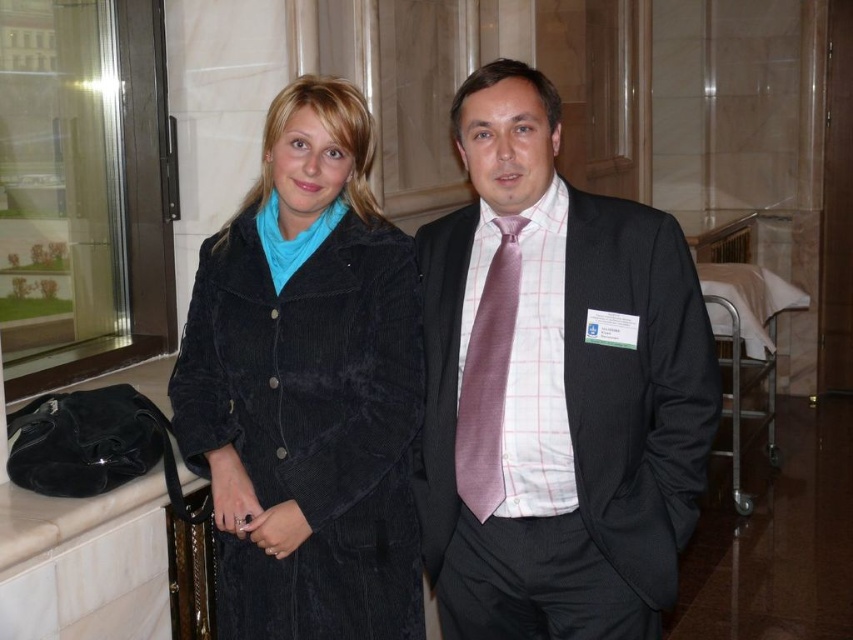
You are organizing a photo shoot and need to ensure that the two subjects, the matte black suit at center and the corduroy coat at center, can fit side by side in a frame that is 1.5 meters wide. Given their widths, will they both fit comfortably without overlapping?

The matte black suit at center is wider than the corduroy coat at center. Since the total width required would be more than 1.5 meters, they might not fit comfortably side by side in the frame without overlapping.

You are a photographer setting up for a group photo. You notice the matte black suit at center and the corduroy coat at center. Which one is positioned closer to the camera?

The matte black suit at center is closer to the viewer than the corduroy coat at center, so the matte black suit at center is positioned closer to the camera.

You are a photographer positioned in front of the two people in the scene. You need to adjust your camera focus to capture both the matte black suit at center and the pink silk tie at center clearly. Which object should you focus on first to ensure both are in sharp focus?

The matte black suit at center is closer to the viewer than the pink silk tie at center. To ensure both are in sharp focus, you should focus on the matte black suit at center first, as it is the closer object. This will maximize the depth of field so that the pink silk tie at center, which is farther away, remains in focus as well.